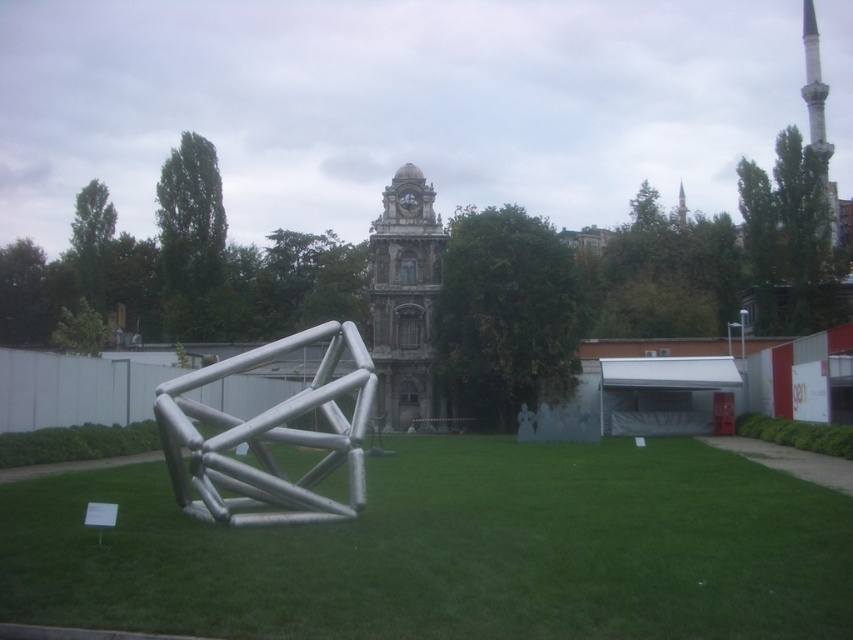
You are a drone operator planning to fly a drone between the silver metallic structure at center and the stone clock tower at center. The drone has a maximum flight distance of 35 meters. Can the drone safely fly between them without exceeding its range?

The silver metallic structure at center and the stone clock tower at center are 36.11 meters apart from each other. Since the drone can only fly up to 35 meters, it cannot safely fly between them without exceeding its range.

Looking at this image, you are standing in the outdoor scene and want to take a photo of the historic building with the sculpture in the foreground. Which point, point (479, 452) or point (811, 4), is better to focus on to ensure both the sculpture and the building are in focus?

Point (479, 452) is closer to the camera than point (811, 4). To ensure both the sculpture and the historic building are in focus, you should focus on the point closer to the camera, which is point (479, 452). This will maximize the depth of field, keeping both foreground and background elements sharp.

You are a photographer planning to capture both the silver metallic structure at center and the stone clock tower at center in a single frame. Based on their heights, which object should you position closer to the camera to ensure both are fully visible in the photo?

The silver metallic structure at center is not as tall as the stone clock tower at center, so you should position the silver metallic structure at center closer to the camera to ensure both are fully visible in the photo.